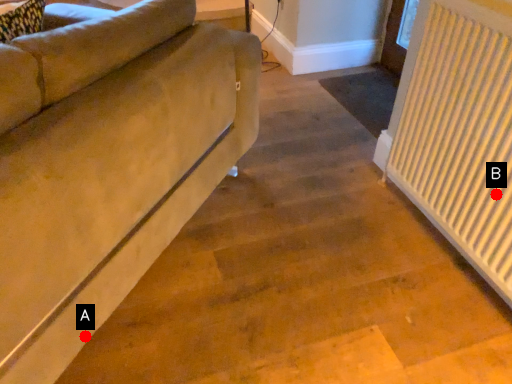
Question: Two points are circled on the image, labeled by A and B beside each circle. Which point appears farthest from the camera in this image?

Choices:
 (A) A is further
 (B) B is further

Answer: (B)